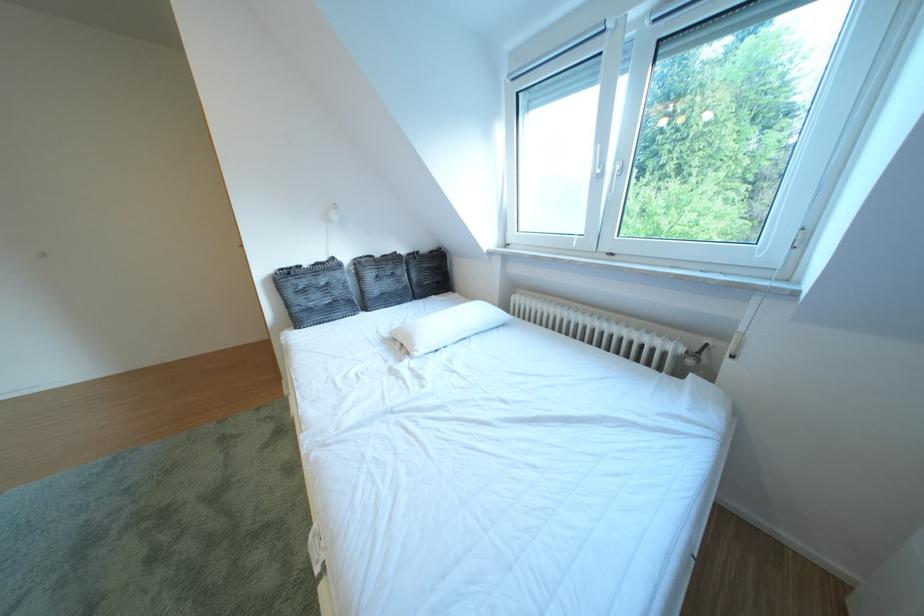
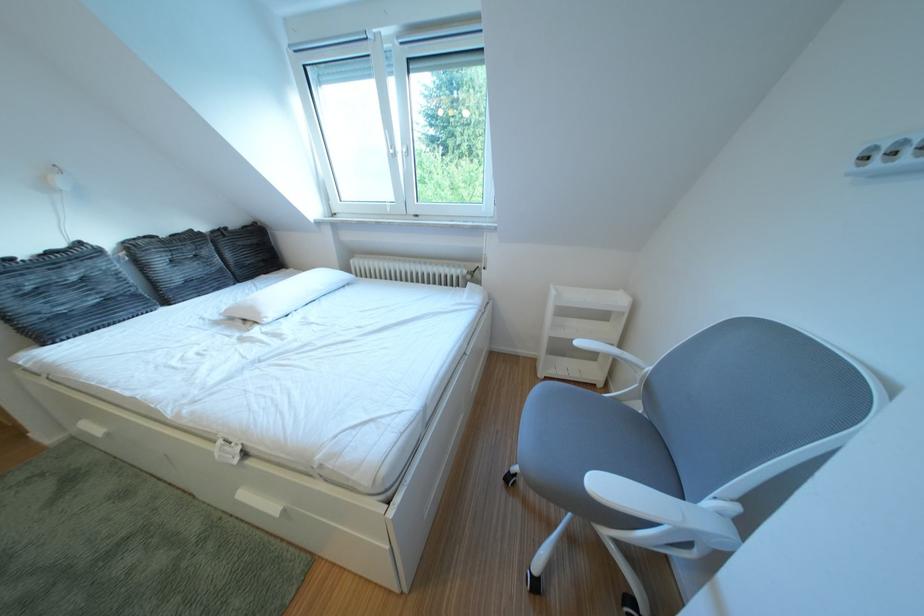
The point at (427, 350) is marked in the first image. Where is the corresponding point in the second image?

(273, 318)